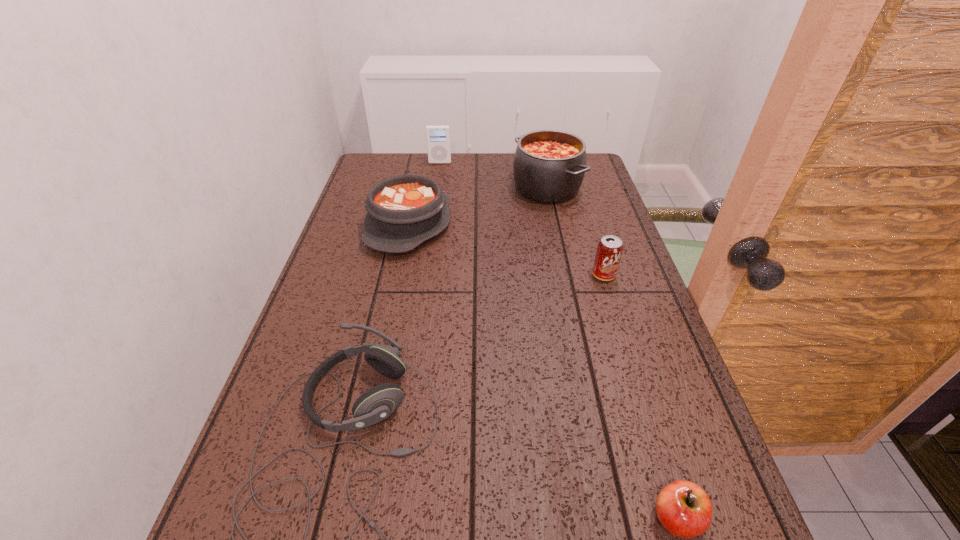
Locate an element on the screen. object that is at the left edge is located at coordinates (x=404, y=211).

Where is `casserole located in the right edge section of the desktop`? The height and width of the screenshot is (540, 960). casserole located in the right edge section of the desktop is located at coordinates (549, 166).

This screenshot has height=540, width=960. Find the location of `soda can present at the right edge`. soda can present at the right edge is located at coordinates (609, 250).

You are a GUI agent. You are given a task and a screenshot of the screen. Output one action in this format:
    pyautogui.click(x=<x>, y=<y>)
    Task: Click on the object at the far right corner
    The width and height of the screenshot is (960, 540).
    Given the screenshot: What is the action you would take?
    pyautogui.click(x=549, y=166)

In the image, there is a desktop. What are the coordinates of `vacant space at the left edge` in the screenshot? It's located at (308, 535).

In the image, there is a desktop. At what (x,y) coordinates should I click in order to perform the action: click on vacant space at the right edge. Please return your answer as a coordinate pair (x, y). Looking at the image, I should click on (627, 281).

Locate an element on the screen. The height and width of the screenshot is (540, 960). vacant position at the far left corner of the desktop is located at coordinates (381, 158).

Find the location of a particular element. free space between the farthest object and the taller casserole is located at coordinates (493, 176).

Where is `free point between the taller casserole and the left casserole`? The width and height of the screenshot is (960, 540). free point between the taller casserole and the left casserole is located at coordinates (478, 206).

You are a GUI agent. You are given a task and a screenshot of the screen. Output one action in this format:
    pyautogui.click(x=<x>, y=<y>)
    Task: Click on the free point between the shorter casserole and the right casserole
    Image resolution: width=960 pixels, height=540 pixels.
    Given the screenshot: What is the action you would take?
    pyautogui.click(x=478, y=206)